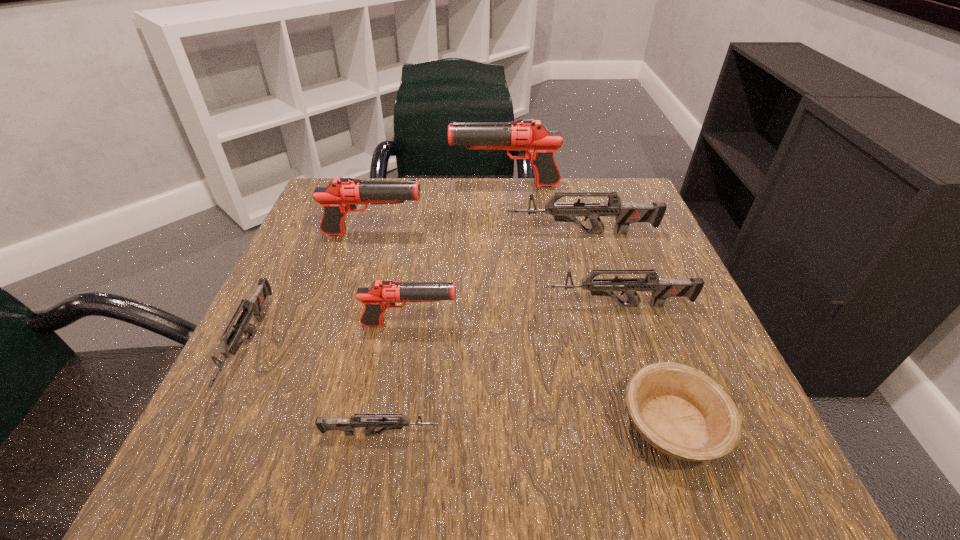
Where is `the shortest gun`? This screenshot has width=960, height=540. the shortest gun is located at coordinates (348, 425).

Where is `the nearest grey gun`? The image size is (960, 540). the nearest grey gun is located at coordinates (348, 425).

Where is `bowl`? bowl is located at coordinates (682, 412).

At what (x,y) coordinates should I click in order to perform the action: click on vacant space situated at the aiming end of the biggest black gun. Please return your answer as a coordinate pair (x, y). Image resolution: width=960 pixels, height=540 pixels. Looking at the image, I should click on (411, 185).

Find the location of a particular element. The image size is (960, 540). blank space located at the aiming end of the biggest black gun is located at coordinates (334, 185).

Where is `vacant space located at the aiming end of the biggest black gun`? This screenshot has height=540, width=960. vacant space located at the aiming end of the biggest black gun is located at coordinates (427, 185).

Where is `vacant area located 0.330m at the aiming end of the seventh shortest object`? Image resolution: width=960 pixels, height=540 pixels. vacant area located 0.330m at the aiming end of the seventh shortest object is located at coordinates (577, 234).

The height and width of the screenshot is (540, 960). I want to click on vacant space located at the aiming end of the nearest black gun, so click(510, 325).

I want to click on vacant area situated aimed along the barrel of the farthest grey gun, so click(x=353, y=233).

This screenshot has height=540, width=960. In order to click on free space located aimed along the barrel of the farthest grey gun in this screenshot , I will do `click(419, 233)`.